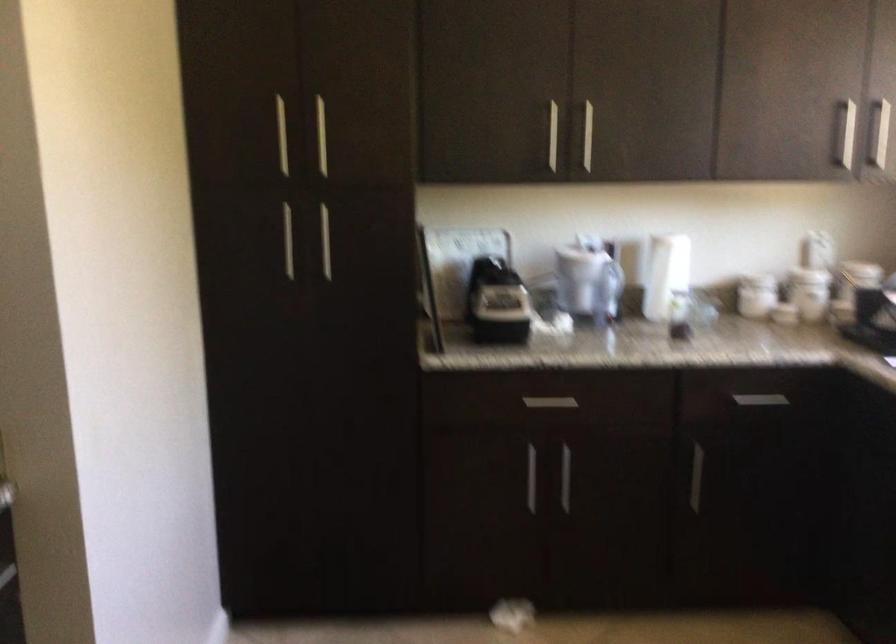
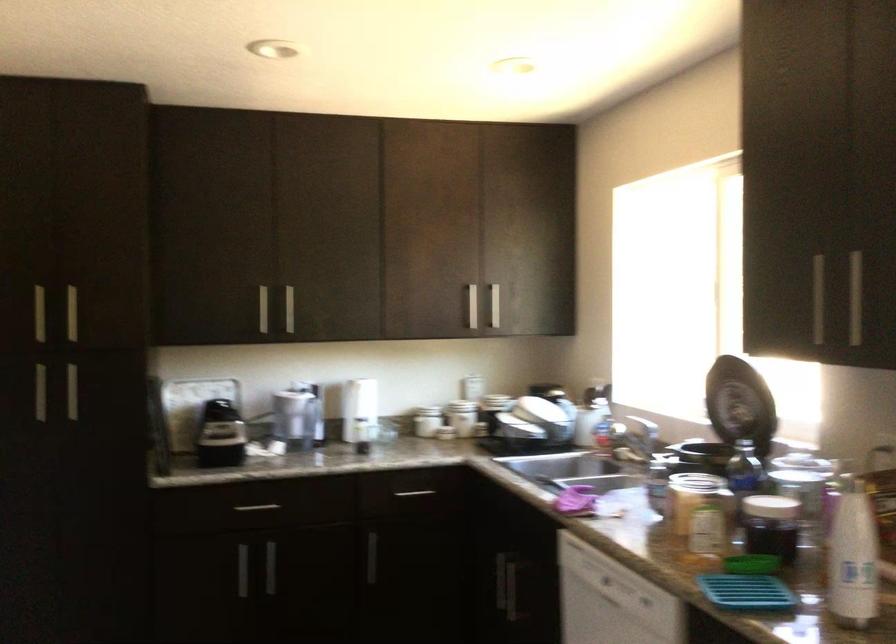
The point at (590, 283) is marked in the first image. Where is the corresponding point in the second image?

(296, 417)